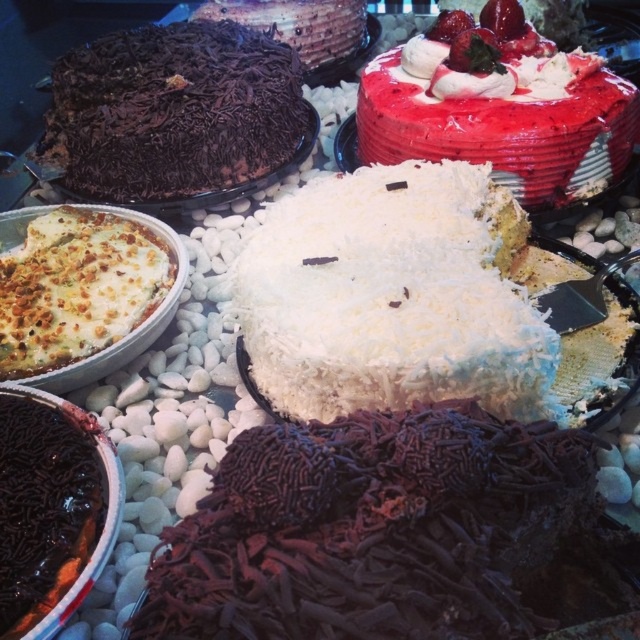
Which is behind, point (460, 109) or point (337, 10)?

Point (337, 10)

Is smooth red frosting cake at upper right wider than chocolate shavings cake at upper center?

Correct, the width of smooth red frosting cake at upper right exceeds that of chocolate shavings cake at upper center.

Where is `smooth red frosting cake at upper right`? smooth red frosting cake at upper right is located at coordinates (504, 124).

Is dark chocolate cake at upper left further to camera compared to smooth red frosting cake at upper right?

Yes, dark chocolate cake at upper left is behind smooth red frosting cake at upper right.

Is dark chocolate cake at upper left taller than smooth red frosting cake at upper right?

Indeed, dark chocolate cake at upper left has a greater height compared to smooth red frosting cake at upper right.

Between point (234, 88) and point (582, 74), which one is positioned in front?

Point (582, 74) is in front.

The height and width of the screenshot is (640, 640). Find the location of `dark chocolate cake at upper left`. dark chocolate cake at upper left is located at coordinates pos(173,112).

Does white coconut cake at center appear under chocolate shavings cake at upper center?

Yes, white coconut cake at center is below chocolate shavings cake at upper center.

Who is shorter, white coconut cake at center or chocolate shavings cake at upper center?

Standing shorter between the two is chocolate shavings cake at upper center.

The image size is (640, 640). Find the location of `white coconut cake at center`. white coconut cake at center is located at coordinates (394, 296).